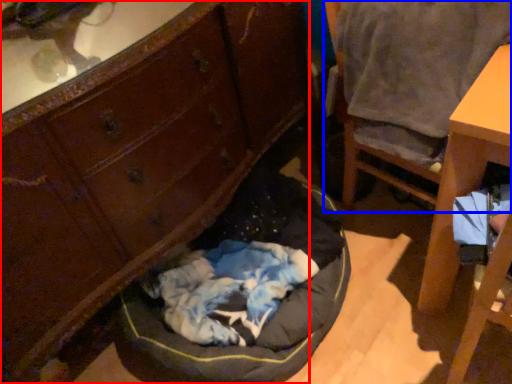
Question: Which point is closer to the camera, cabinetry (highlighted by a red box) or chair (highlighted by a blue box)?

Choices:
 (A) cabinetry
 (B) chair

Answer: (A)